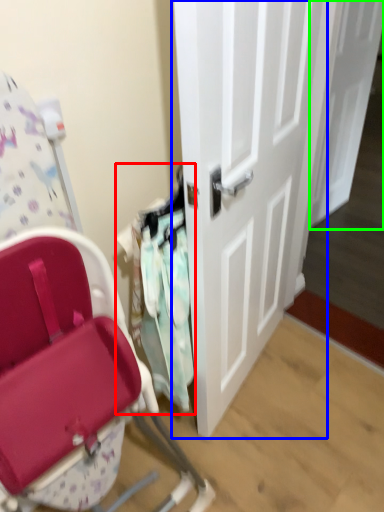
Question: Considering the real-world distances, which object is farthest from laundry (highlighted by a red box)? door (highlighted by a blue box) or door (highlighted by a green box)?

Choices:
 (A) door
 (B) door

Answer: (B)